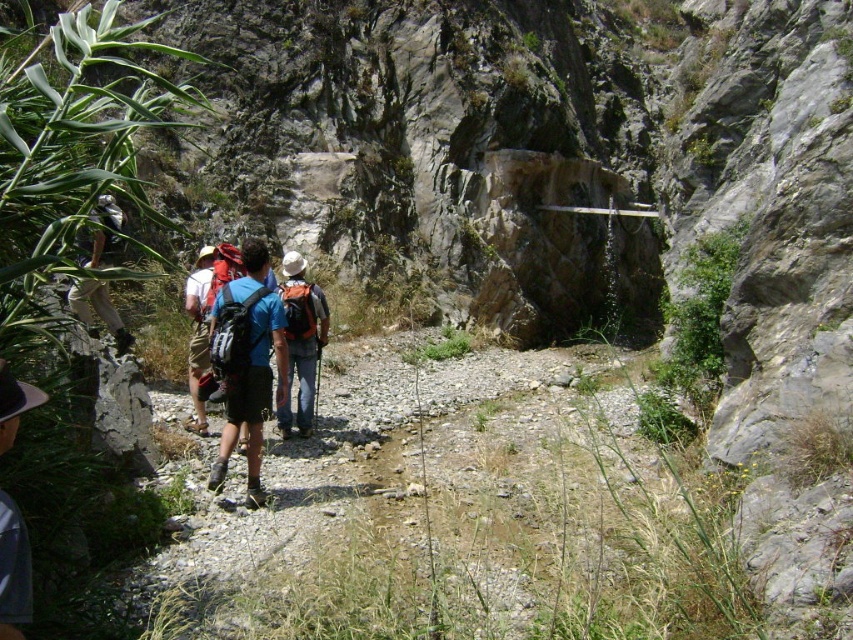
You are a hiker trying to carry both the white felt hat at lower left and the matte gray backpack at center. Which item can you place in a compartment that requires a width of 20 cm without exceeding its limits?

The white felt hat at lower left can be placed in the compartment since its width is less than 20 cm, while the matte gray backpack at center may not fit due to its larger size.

You are a hiker trying to place your matte gray backpack at center on the rocky path. Given the coordinates provided, can you confirm if the backpack is positioned safely on the path?

The matte gray backpack at center is located at point (300, 340), which is on the path, so it is positioned safely.

Consider the image. You are a hiker trying to locate your belongings on the rocky path. You see the white felt hat at lower left and the matte gray backpack at center. Which item is positioned lower in the scene?

The white felt hat at lower left is positioned lower than the matte gray backpack at center.